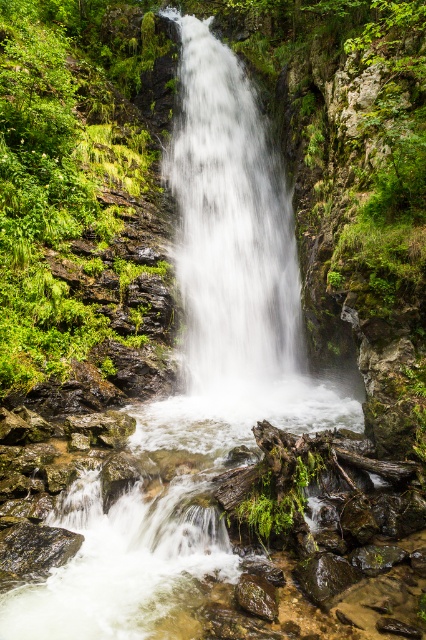
Does white frothy water at center appear over smooth brown rock at lower center?

Yes, white frothy water at center is above smooth brown rock at lower center.

Who is taller, white frothy water at center or smooth brown rock at lower center?

With more height is white frothy water at center.

Where is `white frothy water at center`? This screenshot has width=426, height=640. white frothy water at center is located at coordinates (230, 227).

Locate an element on the screen. This screenshot has width=426, height=640. white frothy water at center is located at coordinates (230, 227).